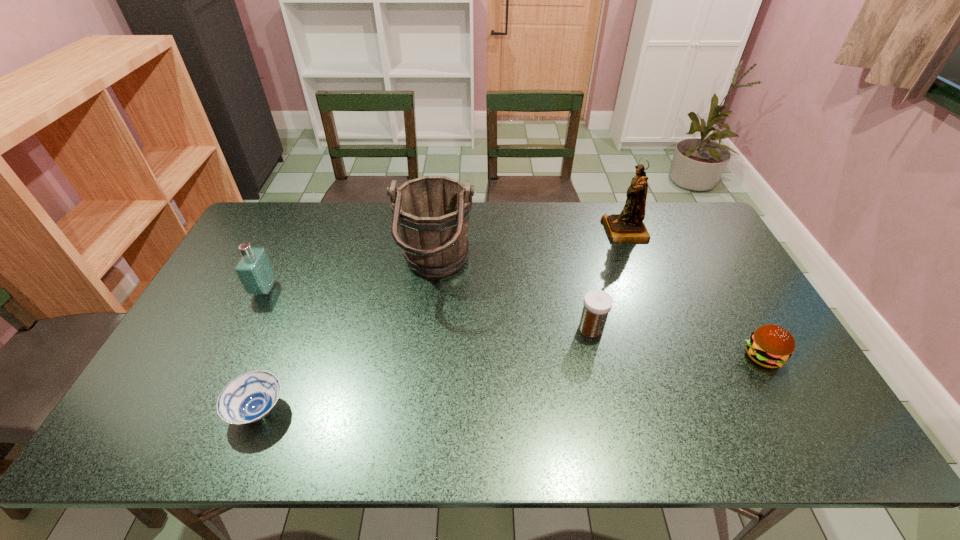
In order to click on free spot that satisfies the following two spatial constraints: 1. on the front label of the fourth shortest object; 2. on the back side of the hamburger in this screenshot , I will do `click(232, 356)`.

Where is `free region that satisfies the following two spatial constraints: 1. on the front label of the third shortest object; 2. on the right side of the perfume`? The image size is (960, 540). free region that satisfies the following two spatial constraints: 1. on the front label of the third shortest object; 2. on the right side of the perfume is located at coordinates (246, 328).

This screenshot has height=540, width=960. In order to click on free region that satisfies the following two spatial constraints: 1. on the back side of the fifth tallest object; 2. on the front label of the third tallest object in this screenshot , I will do `click(726, 289)`.

Locate an element on the screen. The height and width of the screenshot is (540, 960). vacant region that satisfies the following two spatial constraints: 1. on the handle side of the third object from left to right; 2. on the right side of the second nearest object is located at coordinates (426, 356).

In order to click on vacant space that satisfies the following two spatial constraints: 1. on the back side of the third nearest object; 2. on the left side of the second object from left to right in this screenshot , I will do `click(291, 328)`.

Image resolution: width=960 pixels, height=540 pixels. What are the coordinates of `vacant space that satisfies the following two spatial constraints: 1. on the front label of the perfume; 2. on the left side of the soup bowl` in the screenshot? It's located at (205, 410).